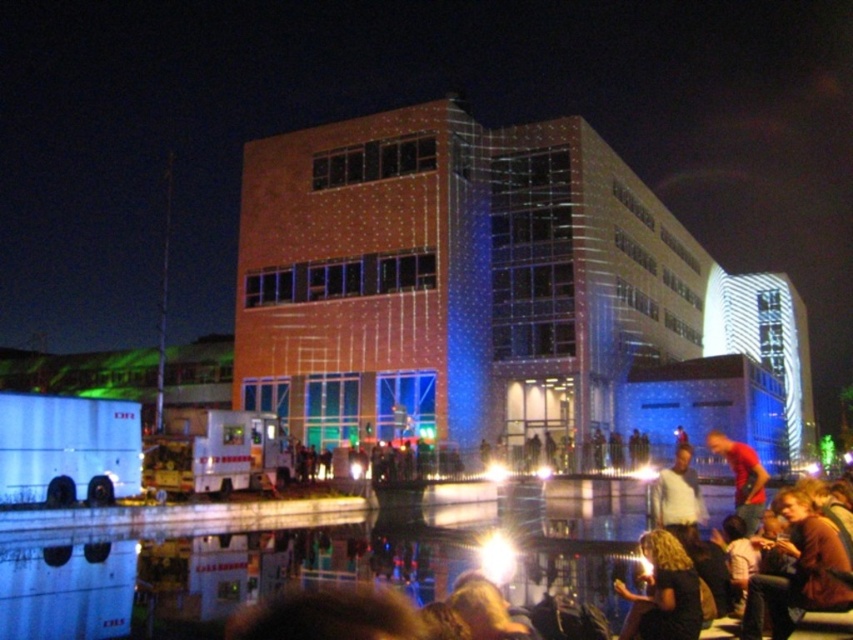
Who is taller, dark hair at lower right or white shirt at center?

white shirt at center is taller.

I want to click on dark hair at lower right, so click(x=663, y=593).

Is dark hair at lower right positioned behind matte red shirt at lower right?

No, dark hair at lower right is closer to the viewer.

Which is more to the left, dark hair at lower right or matte red shirt at lower right?

dark hair at lower right

Which is in front, point (669, 636) or point (750, 529)?

Point (669, 636) is in front.

The image size is (853, 640). I want to click on dark hair at lower right, so click(x=663, y=593).

Measure the distance from white shirt at center to matte red shirt at lower right.

The distance of white shirt at center from matte red shirt at lower right is 3.72 meters.

Is point (686, 509) positioned after point (737, 481)?

That is False.

Where is `white shirt at center`? This screenshot has width=853, height=640. white shirt at center is located at coordinates (677, 497).